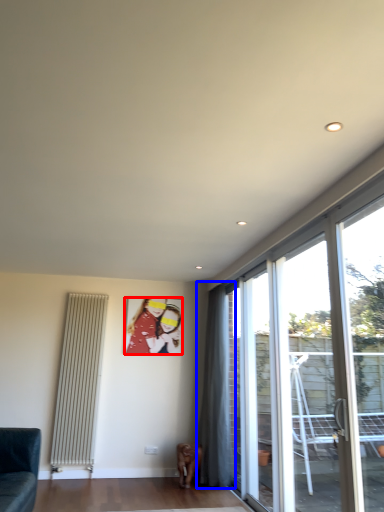
Question: Which object is closer to the camera taking this photo, art (highlighted by a red box) or curtain (highlighted by a blue box)?

Choices:
 (A) art
 (B) curtain

Answer: (B)